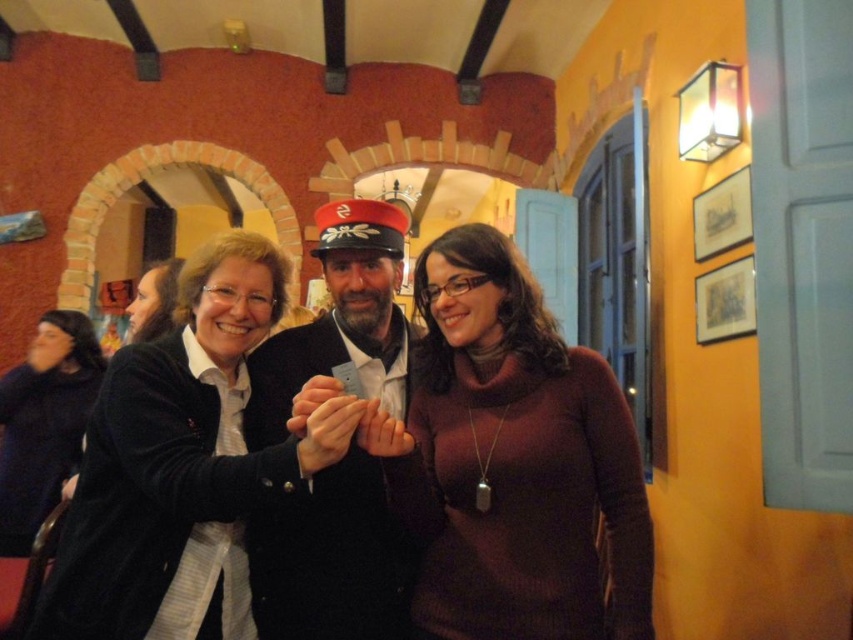
Question: Which point is farther to the camera?

Choices:
 (A) click(343, 508)
 (B) click(428, 529)

Answer: (A)

Question: Among these objects, which one is farthest from the camera?

Choices:
 (A) matte black jacket at center
 (B) burgundy sweater at center
 (C) matte black cardigan at center

Answer: (B)

Question: Is burgundy sweater at center bigger than matte black jacket at center?

Choices:
 (A) yes
 (B) no

Answer: (A)

Question: Which point is closer to the camera?

Choices:
 (A) (270, 609)
 (B) (28, 461)
 (C) (326, 508)

Answer: (A)

Question: Does matte black cardigan at center appear on the left side of dark blue sweater at left?

Choices:
 (A) yes
 (B) no

Answer: (B)

Question: Where is matte black cardigan at center located in relation to matte black jacket at center in the image?

Choices:
 (A) right
 (B) left

Answer: (A)